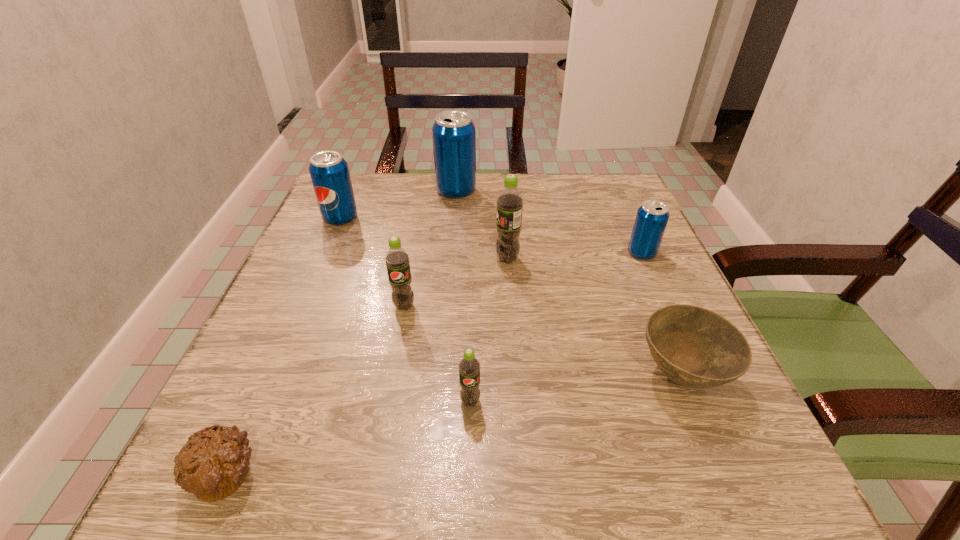
Where is `object that is at the far left corner`? This screenshot has height=540, width=960. object that is at the far left corner is located at coordinates (329, 172).

At what (x,y) coordinates should I click in order to perform the action: click on object located in the near left corner section of the desktop. Please return your answer as a coordinate pair (x, y). This screenshot has width=960, height=540. Looking at the image, I should click on (213, 463).

In the image, there is a desktop. Where is `vacant area at the far edge`? The height and width of the screenshot is (540, 960). vacant area at the far edge is located at coordinates (517, 174).

Identify the location of vacant space at the near edge of the desktop. (530, 485).

Identify the location of free space at the left edge of the desktop. (346, 266).

Locate an element on the screen. This screenshot has width=960, height=540. free space at the right edge is located at coordinates (644, 379).

Where is `vacant space at the far left corner of the desktop`? The width and height of the screenshot is (960, 540). vacant space at the far left corner of the desktop is located at coordinates (354, 222).

You are a GUI agent. You are given a task and a screenshot of the screen. Output one action in this format:
    pyautogui.click(x=<x>, y=<y>)
    Task: Click on the vacant space at the far right corner of the desktop
    The height and width of the screenshot is (540, 960).
    Given the screenshot: What is the action you would take?
    pyautogui.click(x=598, y=205)

Where is `empty space between the muffin and the nearest blue pop soda`? This screenshot has width=960, height=540. empty space between the muffin and the nearest blue pop soda is located at coordinates (434, 362).

Locate an element on the screen. This screenshot has width=960, height=540. vacant space in between the fifth farthest soda and the rightmost soda is located at coordinates (523, 279).